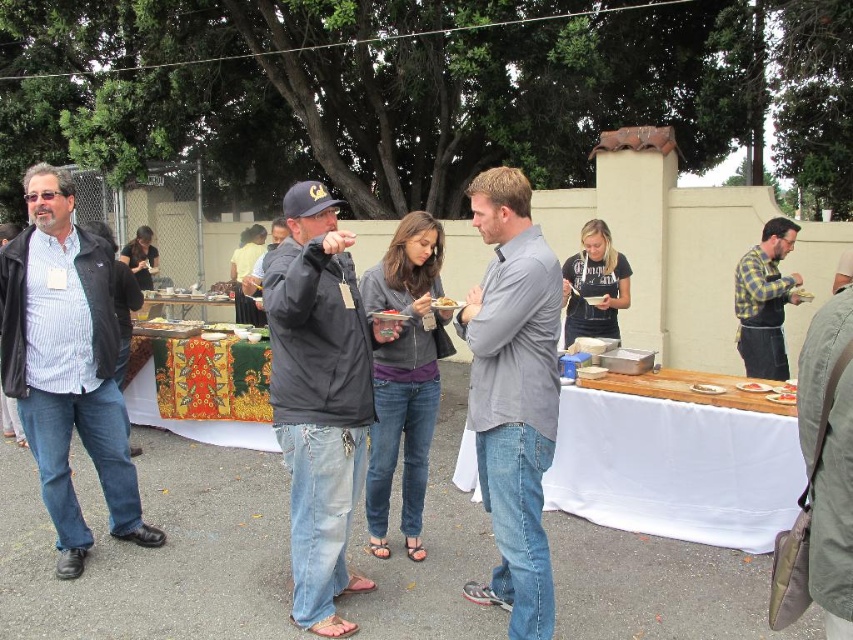
Question: Based on their relative distances, which object is nearer to the dark gray jacket at center?

Choices:
 (A) white cloth table at center
 (B) gray matte shirt at center

Answer: (B)

Question: Does gray matte shirt at center have a larger size compared to textured fabric table at center?

Choices:
 (A) yes
 (B) no

Answer: (B)

Question: Can you confirm if matte black jacket at left is positioned above textured fabric table at center?

Choices:
 (A) no
 (B) yes

Answer: (B)

Question: Which of the following is the closest to the observer?

Choices:
 (A) (473, 483)
 (B) (746, 298)
 (C) (508, 388)

Answer: (C)

Question: Observing the image, what is the correct spatial positioning of dark gray jacket at center in reference to golden crispy pastry at center?

Choices:
 (A) right
 (B) left

Answer: (B)

Question: Which point appears closest to the camera in this image?

Choices:
 (A) (103, 356)
 (B) (265, 310)
 (C) (454, 305)
 (D) (782, 220)

Answer: (B)